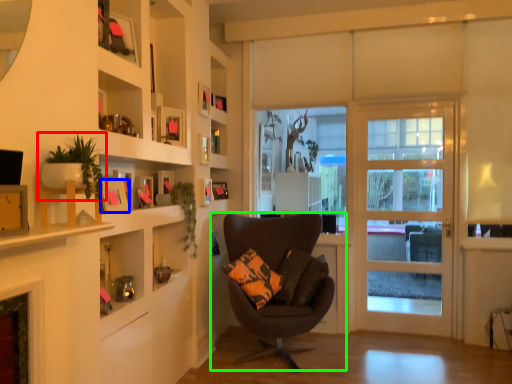
Question: Based on their relative distances, which object is nearer to houseplant (highlighted by a red box)? Choose from picture frame (highlighted by a blue box) and chair (highlighted by a green box).

Choices:
 (A) picture frame
 (B) chair

Answer: (A)